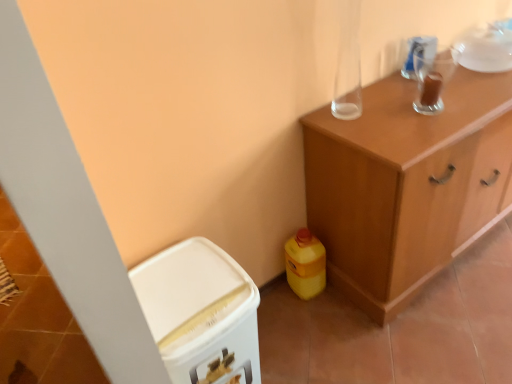
Question: From a real-world perspective, is wooden cabinet at upper right, which is the first cabinetry from right to left, physically located above or below white plastic bin at lower left, which appears as the second cabinetry when viewed from the right?

Choices:
 (A) above
 (B) below

Answer: (A)

Question: In terms of size, does wooden cabinet at upper right, arranged as the 2th cabinetry when viewed from the left, appear bigger or smaller than white plastic bin at lower left, positioned as the first cabinetry in left-to-right order?

Choices:
 (A) small
 (B) big

Answer: (B)

Question: Based on their relative distances, which object is farther from the white plastic bin at lower left, positioned as the first cabinetry in left-to-right order?

Choices:
 (A) wooden cabinet at upper right, arranged as the 2th cabinetry when viewed from the left
 (B) transparent glass cup at upper right
 (C) yellow plastic bottle at lower right

Answer: (B)

Question: Estimate the real-world distances between objects in this image. Which object is farther from the white plastic bin at lower left, positioned as the first cabinetry in left-to-right order?

Choices:
 (A) yellow plastic bottle at lower right
 (B) transparent glass cup at upper right
 (C) wooden cabinet at upper right, arranged as the 2th cabinetry when viewed from the left

Answer: (B)